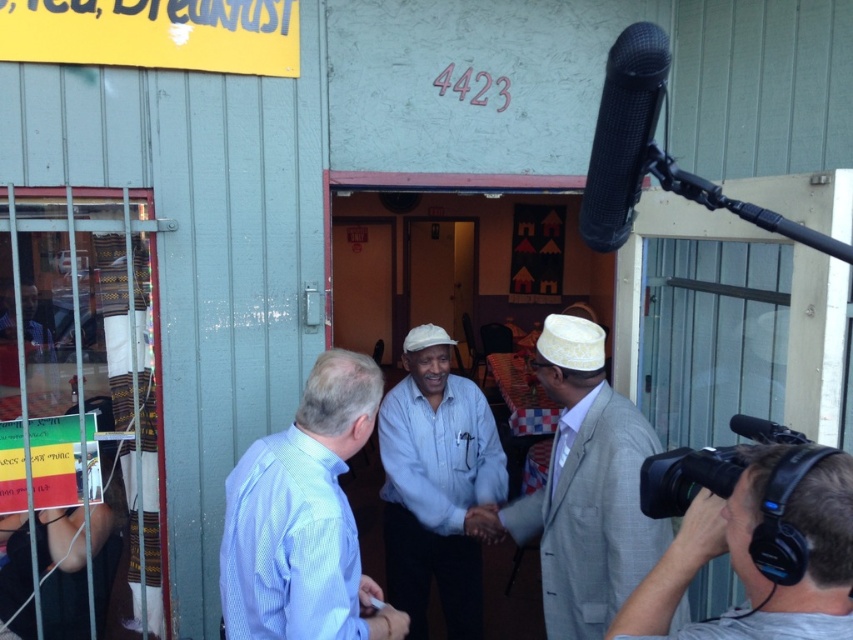
Question: Is white cotton shirt at center thinner than gray fabric camera at lower right?

Choices:
 (A) yes
 (B) no

Answer: (B)

Question: Which object is the farthest from the white cotton shirt at center?

Choices:
 (A) black matte microphone at upper right
 (B) gray fabric camera at lower right
 (C) light blue shirt at center

Answer: (B)

Question: Estimate the real-world distances between objects in this image. Which object is closer to the white cotton shirt at center?

Choices:
 (A) light blue shirt at center
 (B) gray fabric camera at lower right
 (C) black matte microphone at upper right

Answer: (A)

Question: Which point appears closest to the camera in this image?

Choices:
 (A) (606, 392)
 (B) (758, 448)

Answer: (B)

Question: Is white textured suit at center bigger than black matte microphone at upper right?

Choices:
 (A) yes
 (B) no

Answer: (A)

Question: Does white textured suit at center appear on the right side of black matte microphone at upper right?

Choices:
 (A) yes
 (B) no

Answer: (A)